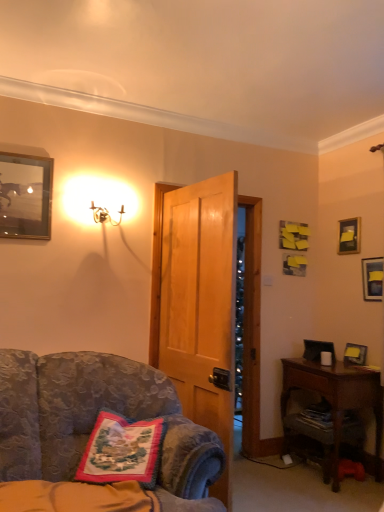
Question: Does metallic silver picture frame at upper left, positioned as the first picture frame in top-to-bottom order, have a greater width compared to matte black picture frame at upper right, positioned as the third picture frame in left-to-right order?

Choices:
 (A) no
 (B) yes

Answer: (B)

Question: Can you confirm if metallic silver picture frame at upper left, the 4th picture frame positioned from the right, is positioned to the right of matte black picture frame at upper right, which is the 2th picture frame from right to left?

Choices:
 (A) no
 (B) yes

Answer: (A)

Question: Does metallic silver picture frame at upper left, the 4th picture frame ordered from the bottom, have a lesser height compared to matte black picture frame at upper right, the fourth picture frame positioned from the front?

Choices:
 (A) yes
 (B) no

Answer: (B)

Question: Does metallic silver picture frame at upper left, which ranks as the first picture frame in left-to-right order, have a larger size compared to matte black picture frame at upper right, the fourth picture frame positioned from the front?

Choices:
 (A) no
 (B) yes

Answer: (B)

Question: Considering the relative sizes of metallic silver picture frame at upper left, which ranks as the first picture frame in left-to-right order, and matte black picture frame at upper right, the fourth picture frame positioned from the front, in the image provided, is metallic silver picture frame at upper left, which ranks as the first picture frame in left-to-right order, taller than matte black picture frame at upper right, the fourth picture frame positioned from the front,?

Choices:
 (A) yes
 (B) no

Answer: (A)

Question: From a real-world perspective, is matte black picture frame at upper right, the fourth picture frame positioned from the front, physically located above or below gold metallic sconce at upper left?

Choices:
 (A) below
 (B) above

Answer: (A)

Question: Based on their positions, is matte black picture frame at upper right, positioned as the 1th picture frame in back-to-front order, located to the left or right of gold metallic sconce at upper left?

Choices:
 (A) left
 (B) right

Answer: (B)

Question: Which is correct: matte black picture frame at upper right, marked as the 2th picture frame in a top-to-bottom arrangement, is inside gold metallic sconce at upper left, or outside of it?

Choices:
 (A) inside
 (B) outside

Answer: (B)

Question: Considering the positions of point (342, 238) and point (104, 219), is point (342, 238) closer or farther from the camera than point (104, 219)?

Choices:
 (A) farther
 (B) closer

Answer: (A)

Question: Considering the positions of white matte coffee cup at right and gold metallic sconce at upper left in the image, is white matte coffee cup at right bigger or smaller than gold metallic sconce at upper left?

Choices:
 (A) big
 (B) small

Answer: (B)

Question: Is white matte coffee cup at right wider or thinner than gold metallic sconce at upper left?

Choices:
 (A) thin
 (B) wide

Answer: (A)

Question: In terms of height, does white matte coffee cup at right look taller or shorter compared to gold metallic sconce at upper left?

Choices:
 (A) short
 (B) tall

Answer: (A)

Question: Relative to gold metallic sconce at upper left, is white matte coffee cup at right in front or behind?

Choices:
 (A) front
 (B) behind

Answer: (B)

Question: Is embroidered fabric pillow at lower left taller or shorter than white matte coffee cup at right?

Choices:
 (A) tall
 (B) short

Answer: (A)

Question: From the image's perspective, relative to white matte coffee cup at right, is embroidered fabric pillow at lower left above or below?

Choices:
 (A) below
 (B) above

Answer: (A)